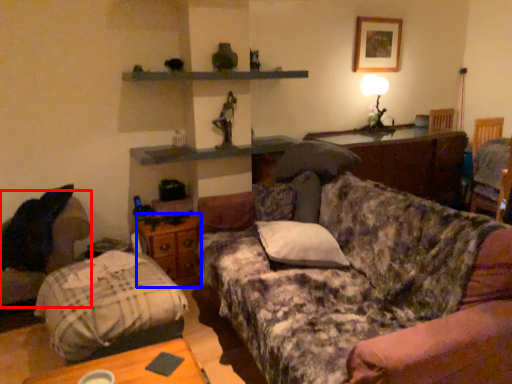
Question: Which object appears farthest to the camera in this image, swivel chair (highlighted by a red box) or drawer (highlighted by a blue box)?

Choices:
 (A) swivel chair
 (B) drawer

Answer: (B)